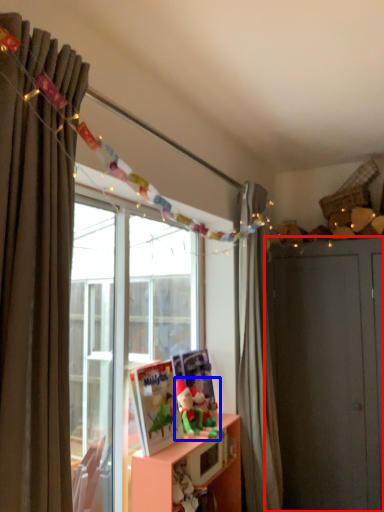
Question: Which object appears closest to the camera in this image, dresser (highlighted by a red box) or toy (highlighted by a blue box)?

Choices:
 (A) dresser
 (B) toy

Answer: (B)